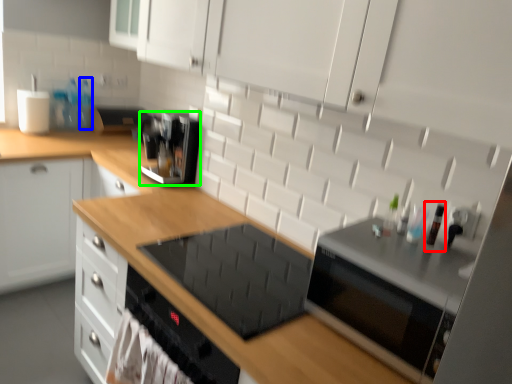
Question: Which object is positioned farthest from bottle (highlighted by a red box)? Select from bottle (highlighted by a blue box) and kitchen appliance (highlighted by a green box).

Choices:
 (A) bottle
 (B) kitchen appliance

Answer: (A)